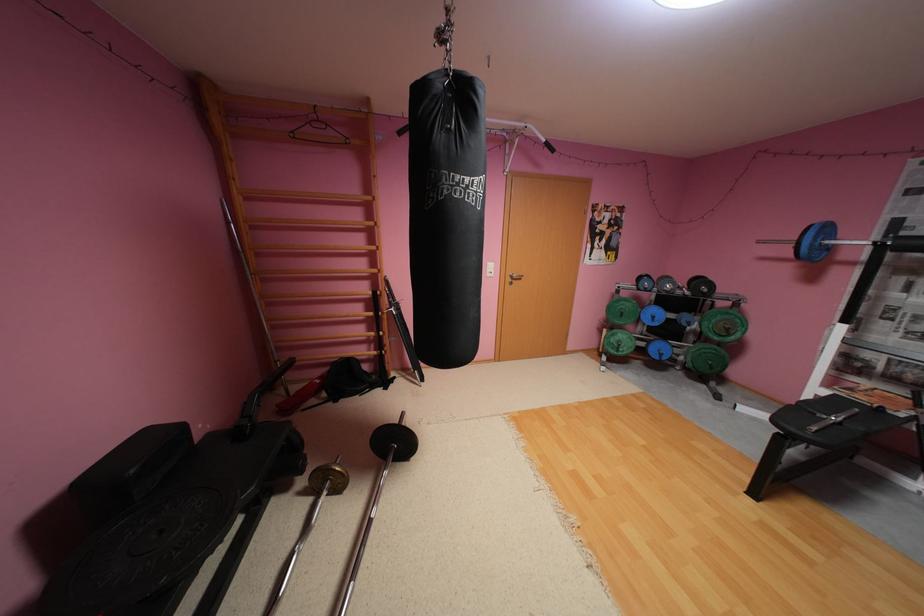
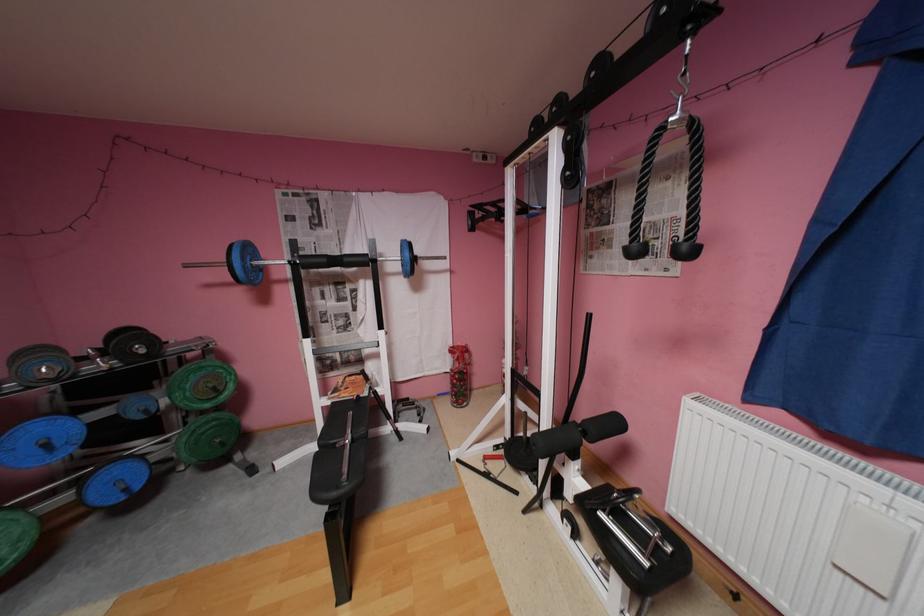
In the second image, find the point that corresponds to [662,317] in the first image.

(55, 445)